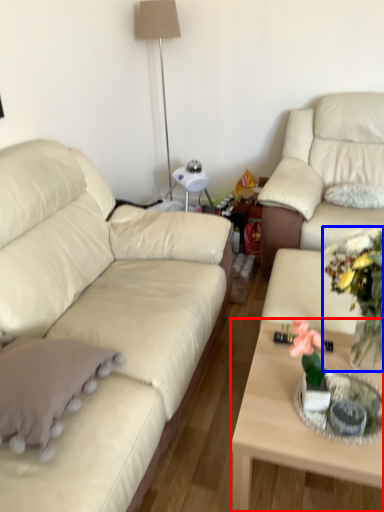
Question: Which of the following is the farthest to the observer, coffee table (highlighted by a red box) or floral arrangement (highlighted by a blue box)?

Choices:
 (A) coffee table
 (B) floral arrangement

Answer: (A)